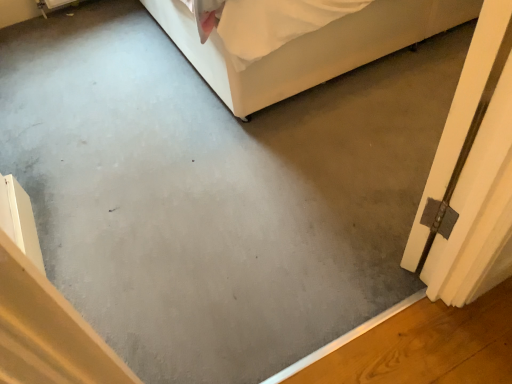
Question: Is metallic silver hinge at right oriented towards white fabric bed at upper center?

Choices:
 (A) yes
 (B) no

Answer: (A)

Question: Is metallic silver hinge at right not within white fabric bed at upper center?

Choices:
 (A) yes
 (B) no

Answer: (A)

Question: From the image's perspective, is metallic silver hinge at right on white fabric bed at upper center?

Choices:
 (A) yes
 (B) no

Answer: (B)

Question: Considering the relative sizes of metallic silver hinge at right and white fabric bed at upper center in the image provided, is metallic silver hinge at right bigger than white fabric bed at upper center?

Choices:
 (A) no
 (B) yes

Answer: (A)

Question: Considering the relative positions of metallic silver hinge at right and white fabric bed at upper center in the image provided, is metallic silver hinge at right to the left of white fabric bed at upper center from the viewer's perspective?

Choices:
 (A) no
 (B) yes

Answer: (A)

Question: Is white fabric bed at upper center surrounded by metallic silver hinge at right?

Choices:
 (A) no
 (B) yes

Answer: (A)

Question: Is white fabric bed at upper center beside metallic silver hinge at right?

Choices:
 (A) yes
 (B) no

Answer: (B)

Question: From a real-world perspective, is white fabric bed at upper center under metallic silver hinge at right?

Choices:
 (A) yes
 (B) no

Answer: (A)

Question: Does white fabric bed at upper center appear on the right side of metallic silver hinge at right?

Choices:
 (A) yes
 (B) no

Answer: (B)

Question: From a real-world perspective, is white fabric bed at upper center located higher than metallic silver hinge at right?

Choices:
 (A) yes
 (B) no

Answer: (B)

Question: Is metallic silver hinge at right located within white fabric bed at upper center?

Choices:
 (A) yes
 (B) no

Answer: (B)

Question: From the image's perspective, is white fabric bed at upper center under metallic silver hinge at right?

Choices:
 (A) yes
 (B) no

Answer: (B)

Question: In the image, is white fabric bed at upper center positioned in front of or behind metallic silver hinge at right?

Choices:
 (A) behind
 (B) front

Answer: (A)